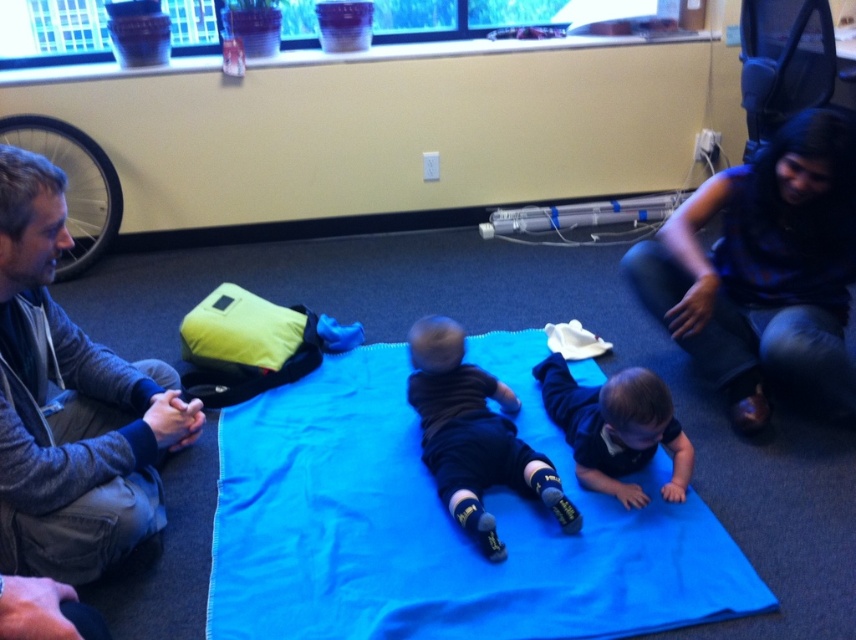
Question: Among these points, which one is farthest from the camera?

Choices:
 (A) (447, 381)
 (B) (394, 465)
 (C) (613, 465)

Answer: (B)

Question: Is gray fleece jacket at left wider than dark blue fabric at center?

Choices:
 (A) yes
 (B) no

Answer: (B)

Question: Which is farther from the black matte socks at center?

Choices:
 (A) gray fleece jacket at left
 (B) dark blue fabric at center

Answer: (A)

Question: Which point is farther from the camera taking this photo?

Choices:
 (A) (218, 426)
 (B) (6, 531)
 (C) (548, 474)

Answer: (A)

Question: Does gray fleece jacket at left appear under dark blue fabric at center?

Choices:
 (A) no
 (B) yes

Answer: (A)

Question: Considering the relative positions of blue fabric at center and black matte socks at center in the image provided, where is blue fabric at center located with respect to black matte socks at center?

Choices:
 (A) above
 (B) below

Answer: (B)